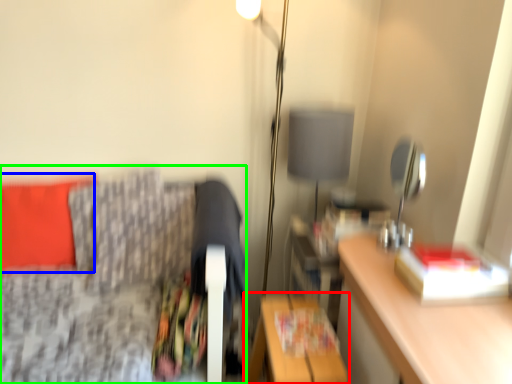
Question: Which is nearer to the table (highlighted by a red box)? pillow (highlighted by a blue box) or furniture (highlighted by a green box).

Choices:
 (A) pillow
 (B) furniture

Answer: (B)